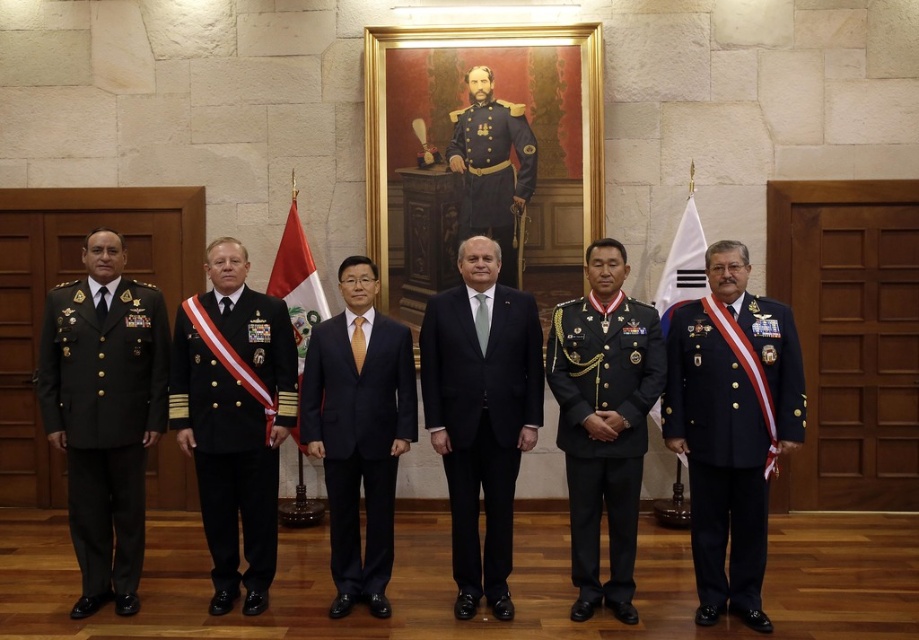
Can you confirm if dark green military uniform at left is wider than navy blue suit at center?

Correct, the width of dark green military uniform at left exceeds that of navy blue suit at center.

Does dark green military uniform at left have a lesser height compared to navy blue suit at center?

No.

Locate an element on the screen. The image size is (919, 640). dark green military uniform at left is located at coordinates (104, 417).

The width and height of the screenshot is (919, 640). I want to click on dark green military uniform at left, so click(x=104, y=417).

Does point (772, 397) come in front of point (298, 339)?

Yes, it is.

Is the position of dark blue fabric military uniform at right less distant than that of red fabric flag at center?

Yes, dark blue fabric military uniform at right is in front of red fabric flag at center.

Who is more forward, (758, 589) or (310, 326)?

Point (758, 589)

You are a GUI agent. You are given a task and a screenshot of the screen. Output one action in this format:
    pyautogui.click(x=<x>, y=<y>)
    Task: Click on the dark blue fabric military uniform at right
    
    Given the screenshot: What is the action you would take?
    pyautogui.click(x=718, y=458)

Is dark green military uniform at left thinner than black satin suit at center?

No.

Is dark green military uniform at left closer to the viewer compared to black satin suit at center?

Yes, dark green military uniform at left is in front of black satin suit at center.

Locate an element on the screen. The height and width of the screenshot is (640, 919). dark green military uniform at left is located at coordinates (104, 417).

Where is `dark green military uniform at left`? The image size is (919, 640). dark green military uniform at left is located at coordinates (104, 417).